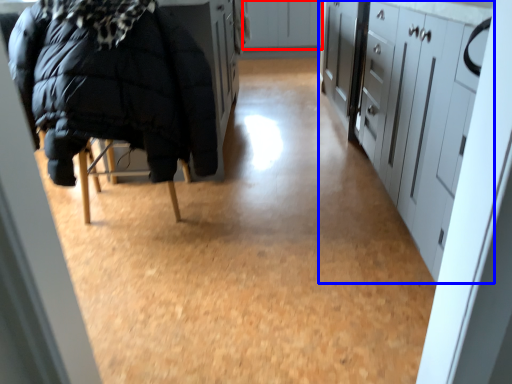
Question: Which of the following is the closest to the observer, cabinetry (highlighted by a red box) or cabinetry (highlighted by a blue box)?

Choices:
 (A) cabinetry
 (B) cabinetry

Answer: (B)